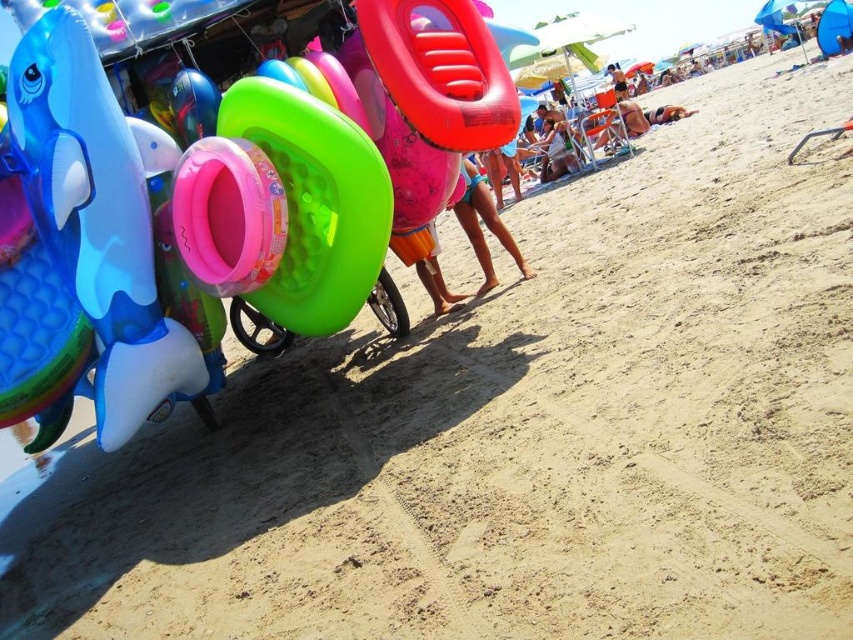
Which is in front, point (242, 184) or point (53, 371)?

Positioned in front is point (242, 184).

Can you confirm if rubber inflatable ring at left is positioned above blue rubber dolphin at left?

Correct, rubber inflatable ring at left is located above blue rubber dolphin at left.

Between point (439, 124) and point (9, 196), which one is positioned in front?

Point (439, 124) is more forward.

Locate an element on the screen. The image size is (853, 640). rubber inflatable ring at left is located at coordinates (216, 202).

Can you confirm if blue rubber dolphin at left is smaller than pink matte swimsuit at center?

Incorrect, blue rubber dolphin at left is not smaller in size than pink matte swimsuit at center.

Does point (186, 355) lie behind point (473, 198)?

No, (186, 355) is closer to viewer.

Does point (73, 284) lie behind point (467, 225)?

No, (73, 284) is in front of (467, 225).

This screenshot has width=853, height=640. In order to click on blue rubber dolphin at left in this screenshot , I will do `click(80, 250)`.

Is pink matte swimsuit at center to the right of orange cotton shorts at center from the viewer's perspective?

Indeed, pink matte swimsuit at center is positioned on the right side of orange cotton shorts at center.

Image resolution: width=853 pixels, height=640 pixels. What are the coordinates of `pink matte swimsuit at center` in the screenshot? It's located at (485, 225).

The height and width of the screenshot is (640, 853). In order to click on pink matte swimsuit at center in this screenshot , I will do pos(485,225).